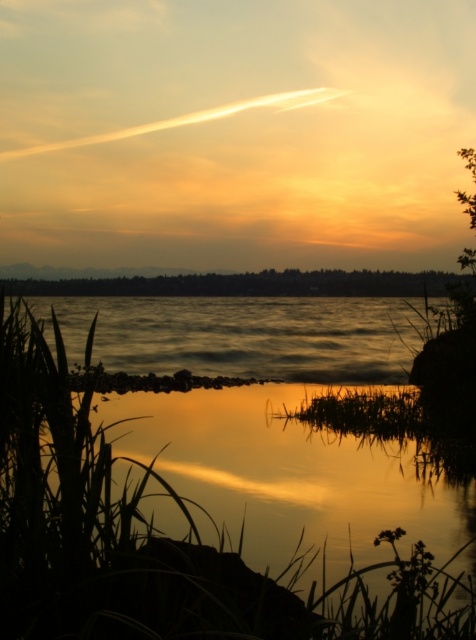
Question: Which object is closer to the camera taking this photo?

Choices:
 (A) golden reflective water at lower center
 (B) shiny reflective water at center

Answer: (A)

Question: Can you confirm if golden reflective water at lower center is smaller than shiny reflective water at center?

Choices:
 (A) yes
 (B) no

Answer: (A)

Question: Which point is farther from the camera taking this photo?

Choices:
 (A) tap(160, 627)
 (B) tap(320, 337)

Answer: (B)

Question: Is golden reflective water at lower center to the right of shiny reflective water at center from the viewer's perspective?

Choices:
 (A) yes
 (B) no

Answer: (A)

Question: Can you confirm if golden reflective water at lower center is thinner than shiny reflective water at center?

Choices:
 (A) yes
 (B) no

Answer: (A)